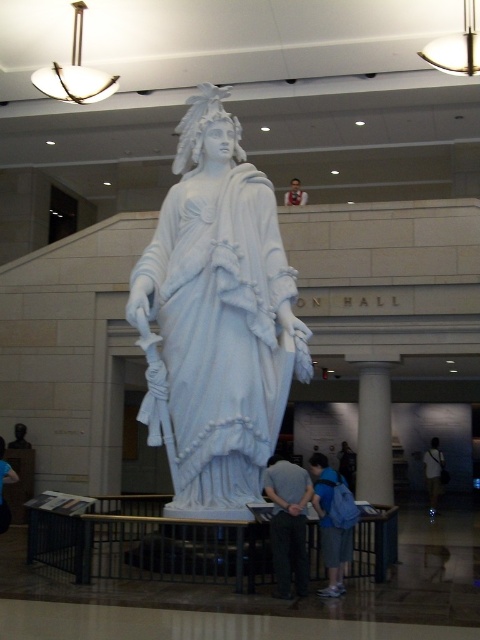
You are an interior designer assessing the placement of the gray fabric pants at lower center and the blue denim jeans at lower left in the museum. Which of the two items is shorter in height?

The gray fabric pants at lower center is shorter in height compared to the blue denim jeans at lower left.

You are a visitor in the museum and want to take a photo of the white marble pillar at center without the dark blue backpack at lower right appearing in the frame. Which direction should you move to achieve this?

Move to the right side of the white marble pillar at center so that the dark blue backpack at lower right is no longer in the frame since the pillar is to the left of the backpack.